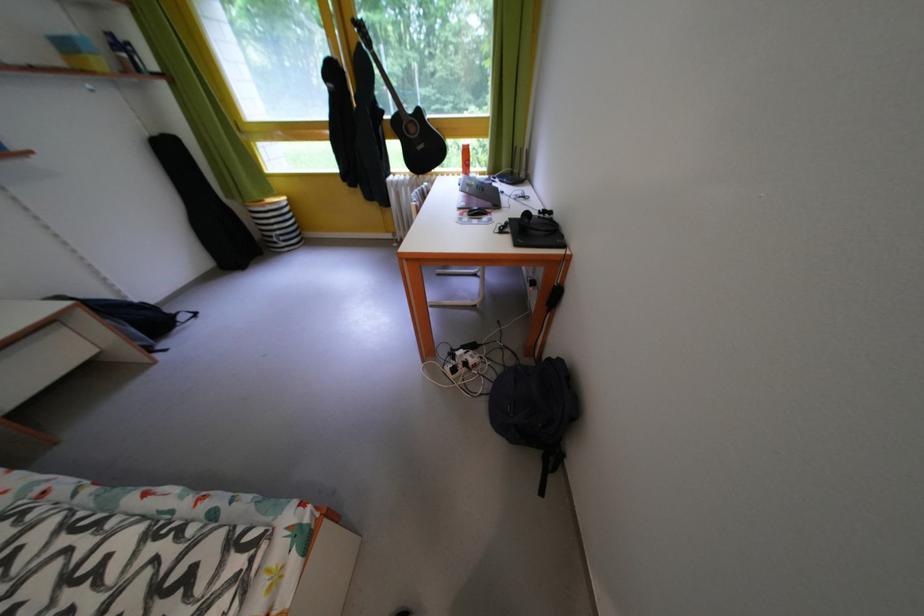
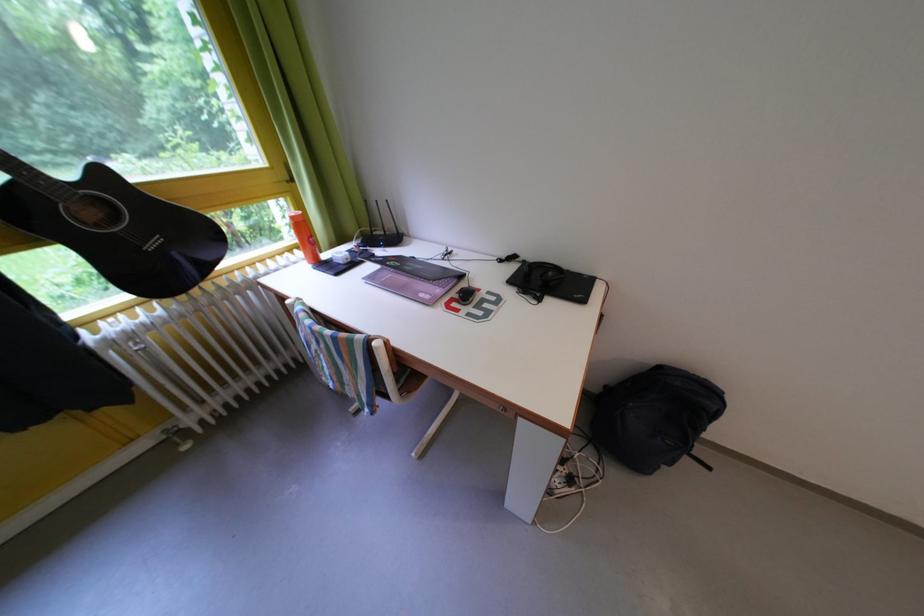
Locate, in the second image, the point that corresponds to (x=429, y=116) in the first image.

(112, 179)